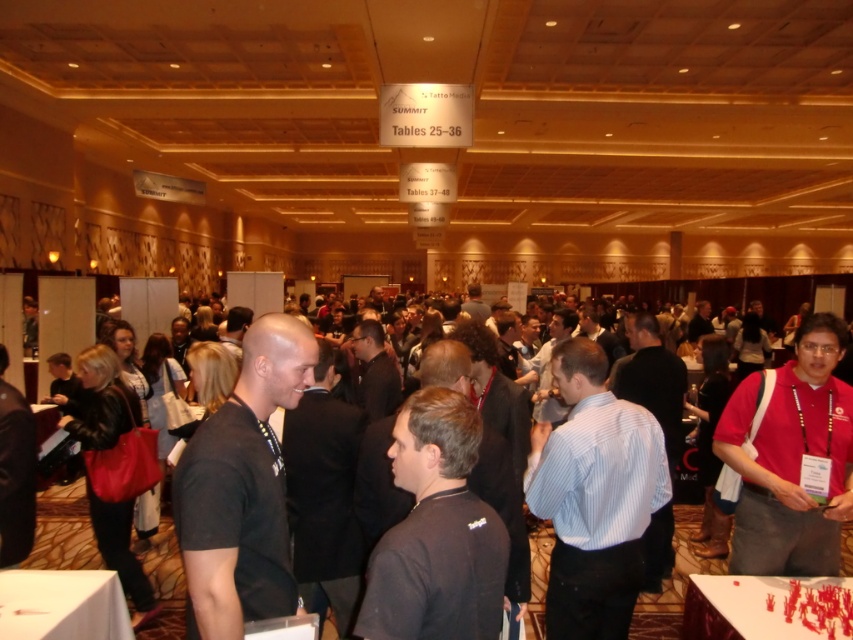
Between point (788, 426) and point (62, 588), which one is positioned behind?

The point (788, 426) is behind.

Who is more distant from viewer, [817,445] or [30,627]?

The point [817,445] is behind.

Identify the location of matte red shirt at center. The height and width of the screenshot is (640, 853). (792, 460).

In the scene shown: Who is shorter, blue striped shirt at center or white paper at lower left?

With less height is white paper at lower left.

At what (x,y) coordinates should I click in order to perform the action: click on blue striped shirt at center. Please return your answer as a coordinate pair (x, y). Looking at the image, I should click on (595, 497).

Who is higher up, matte red shirt at center or white paper table at center?

matte red shirt at center is above.

Does matte red shirt at center appear on the left side of white paper table at center?

In fact, matte red shirt at center is to the right of white paper table at center.

Which is in front, point (767, 435) or point (817, 584)?

Positioned in front is point (817, 584).

What are the coordinates of `matte red shirt at center` in the screenshot? It's located at (792, 460).